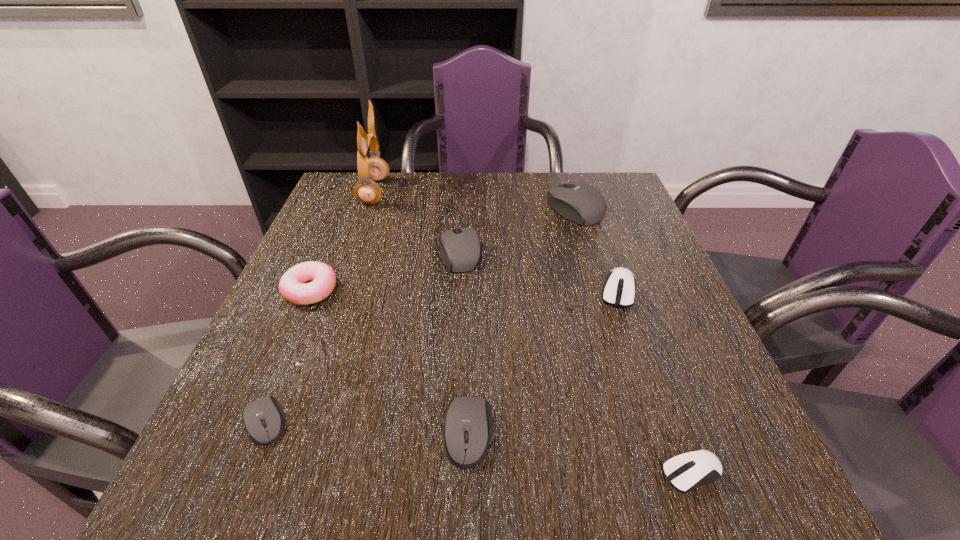
Identify the location of the leftmost computer equipment. The height and width of the screenshot is (540, 960). (266, 408).

Locate an element on the screen. The image size is (960, 540). vacant space located on the front-facing side of the earphone is located at coordinates (462, 192).

Where is `vacant area situated 0.230m on the front of the farthest black computer equipment`? vacant area situated 0.230m on the front of the farthest black computer equipment is located at coordinates (599, 288).

Identify the location of vacant space located on the front of the third smallest black computer equipment. pyautogui.click(x=458, y=292).

At what (x,y) coordinates should I click in order to perform the action: click on free space located on the front of the doughnut. Please return your answer as a coordinate pair (x, y). This screenshot has height=540, width=960. Looking at the image, I should click on coord(275,374).

This screenshot has width=960, height=540. I want to click on vacant space positioned 0.130m on the front of the farther white mouse, so click(643, 362).

Locate an element on the screen. This screenshot has width=960, height=540. free space located on the right of the second smallest black computer equipment is located at coordinates (743, 433).

Find the location of a particular element. The width and height of the screenshot is (960, 540). blank space located on the left of the smaller white mouse is located at coordinates (421, 473).

You are a GUI agent. You are given a task and a screenshot of the screen. Output one action in this format:
    pyautogui.click(x=<x>, y=<y>)
    Task: Click on the free space located on the front of the leftmost black computer equipment
    This screenshot has width=960, height=540.
    Given the screenshot: What is the action you would take?
    pyautogui.click(x=243, y=480)

Find the location of a particular element. The width and height of the screenshot is (960, 540). earphone present at the far edge is located at coordinates (367, 191).